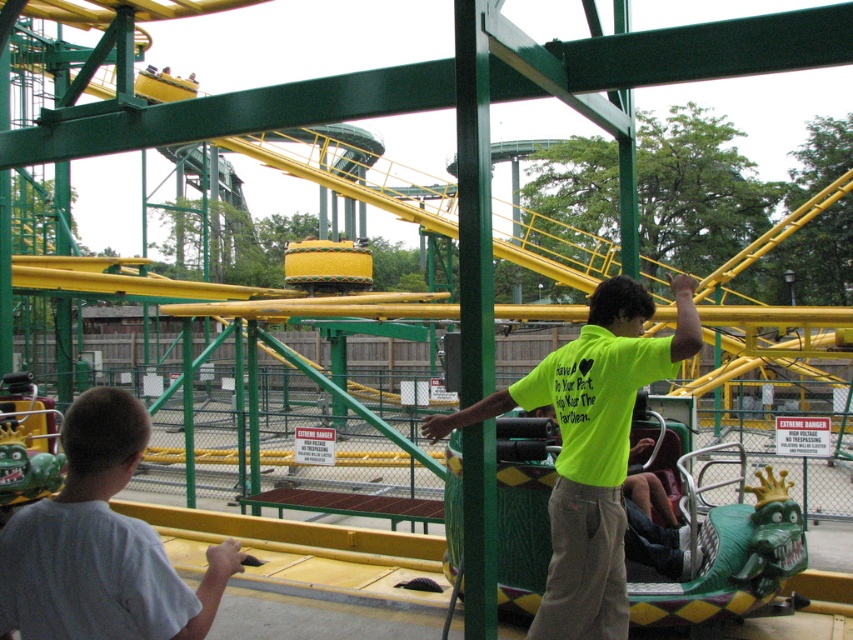
Locate an element on the screen. neon yellow t-shirt at center is located at coordinates (590, 448).

Which is in front, point (439, 435) or point (28, 557)?

Point (28, 557) is in front.

Locate an element on the screen. Image resolution: width=853 pixels, height=640 pixels. neon yellow t-shirt at center is located at coordinates (590, 448).